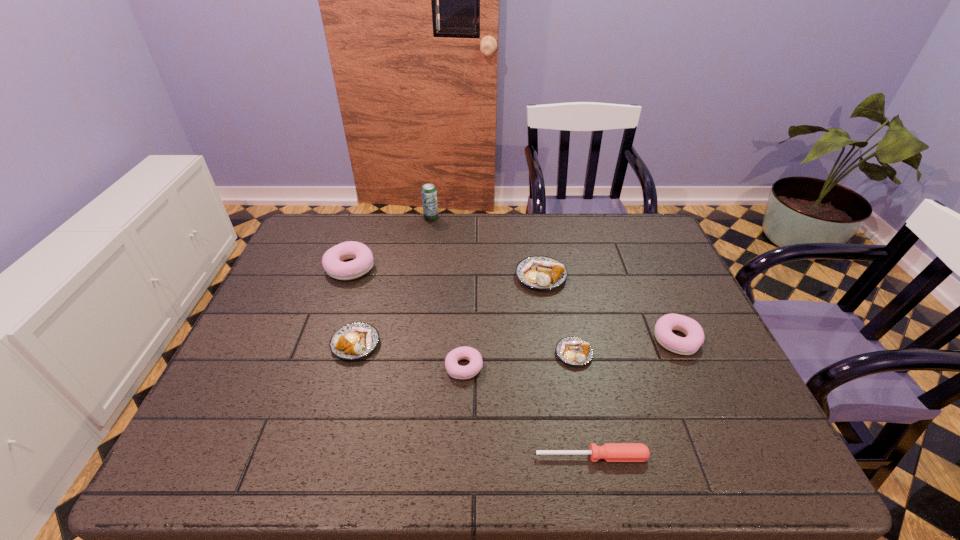
At what (x,y) coordinates should I click in order to perform the action: click on the smallest brown pastry. Please return your answer as a coordinate pair (x, y). Image resolution: width=960 pixels, height=540 pixels. Looking at the image, I should click on (574, 351).

Identify the location of screwdriver. (611, 452).

Identify the location of the nearest object. This screenshot has width=960, height=540. (611, 452).

The image size is (960, 540). In order to click on free point located 0.240m on the right of the tallest object in this screenshot , I will do `click(508, 218)`.

Identify the location of vacant space located on the front of the leftmost pink pastry. Image resolution: width=960 pixels, height=540 pixels. (331, 322).

Locate an element on the screen. This screenshot has height=540, width=960. free location located on the front of the biggest brown pastry is located at coordinates (558, 381).

Image resolution: width=960 pixels, height=540 pixels. Identify the location of free space located on the front of the rightmost object. coord(704,402).

Identify the location of vacant space located on the front of the second smallest brown pastry. (345, 384).

Locate an element on the screen. This screenshot has width=960, height=540. free region located 0.110m on the back of the smallest pink pastry is located at coordinates (466, 320).

Where is `free space located on the back of the smallest brown pastry`? free space located on the back of the smallest brown pastry is located at coordinates (566, 316).